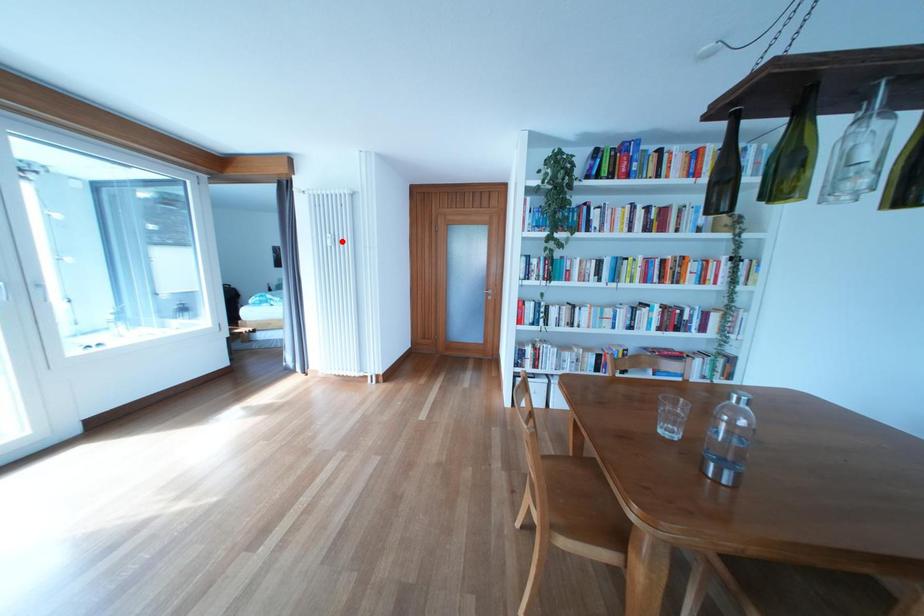
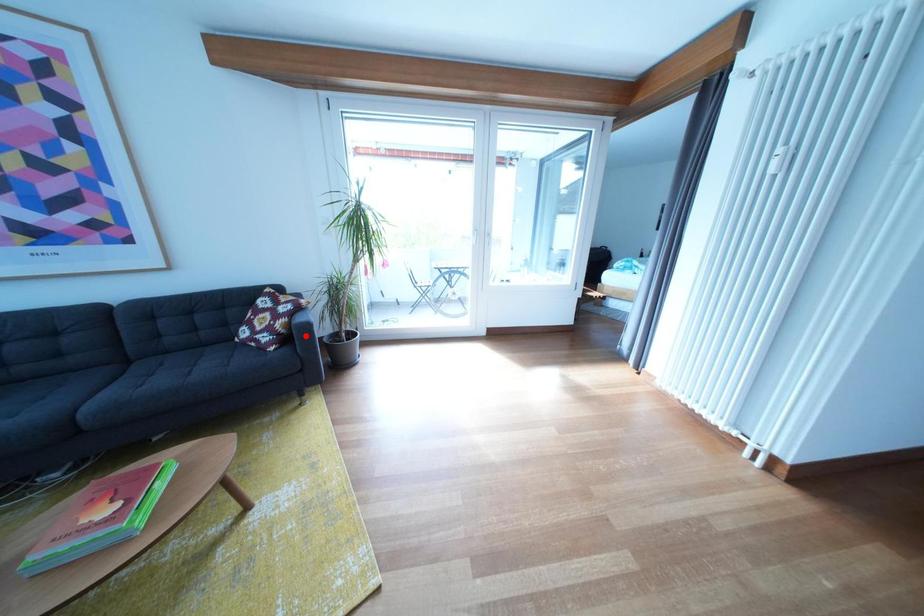
I am providing you with two images of the same scene from different viewpoints. A red point is marked on the first image and another point is marked on the second image. Are the points marked in image1 and image2 representing the same 3D position?

No